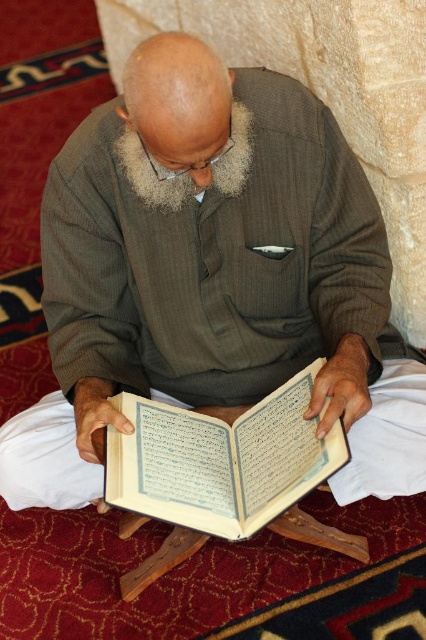
Does brown textured sweater at center have a lesser height compared to white fluffy beard at center?

No, brown textured sweater at center is not shorter than white fluffy beard at center.

Is brown textured sweater at center thinner than white fluffy beard at center?

In fact, brown textured sweater at center might be wider than white fluffy beard at center.

Where is `brown textured sweater at center`? The image size is (426, 640). brown textured sweater at center is located at coordinates (206, 266).

Can you confirm if white paper book at center is bigger than white fluffy beard at center?

Indeed, white paper book at center has a larger size compared to white fluffy beard at center.

Can you confirm if white paper book at center is wider than white fluffy beard at center?

Yes, white paper book at center is wider than white fluffy beard at center.

Which is in front, point (241, 492) or point (132, 173)?

Point (132, 173)

Locate an element on the screen. Image resolution: width=426 pixels, height=640 pixels. white paper book at center is located at coordinates (221, 460).

Is brown textured sweater at center taller than white paper book at center?

Correct, brown textured sweater at center is much taller as white paper book at center.

Between point (204, 58) and point (155, 496), which one is positioned behind?

Point (155, 496)

Locate an element on the screen. This screenshot has width=426, height=640. brown textured sweater at center is located at coordinates (206, 266).